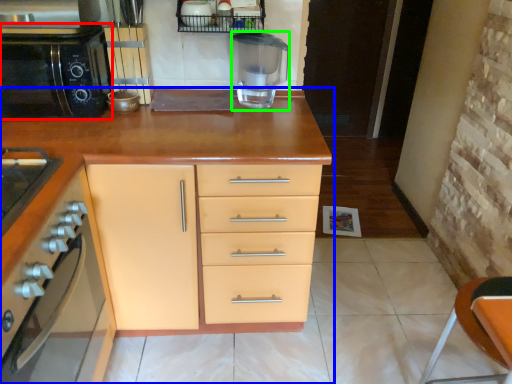
Question: Considering the real-world distances, which object is closest to home appliance (highlighted by a red box)? cabinetry (highlighted by a blue box) or blender (highlighted by a green box).

Choices:
 (A) cabinetry
 (B) blender

Answer: (A)